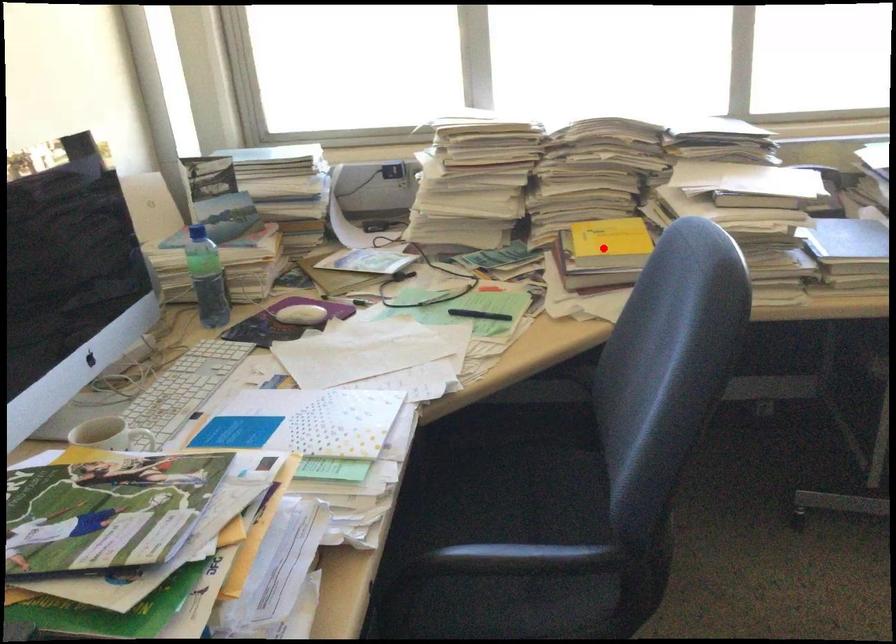
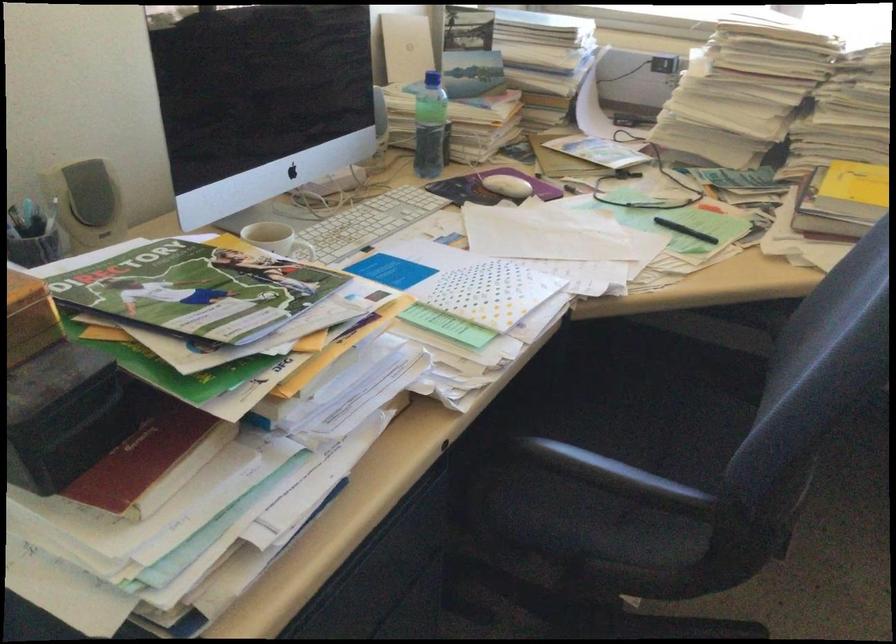
Question: I am providing you with two images of the same scene from different viewpoints. A red point is shown in image1. For the corresponding object point in image2, is it positioned nearer or farther from the camera?

Choices:
 (A) Nearer
 (B) Farther

Answer: (A)